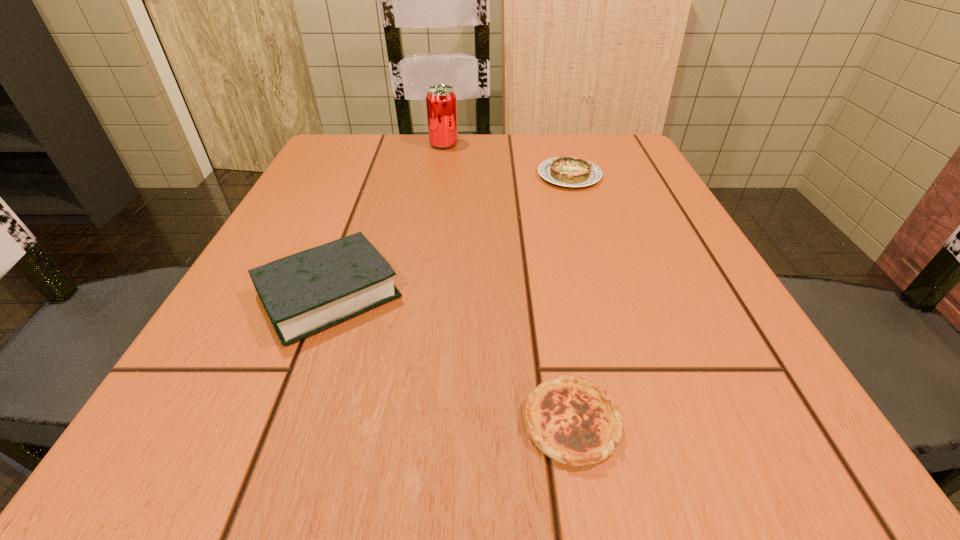
Identify the location of soda can that is at the far edge. click(x=441, y=101).

What are the coordinates of `quiche present at the far edge` in the screenshot? It's located at (567, 171).

Image resolution: width=960 pixels, height=540 pixels. Find the location of `object present at the near edge`. object present at the near edge is located at coordinates (574, 421).

At what (x,y) coordinates should I click in order to perform the action: click on object situated at the left edge. Please return your answer as a coordinate pair (x, y). Looking at the image, I should click on (304, 293).

Locate an element on the screen. Image resolution: width=960 pixels, height=540 pixels. object at the right edge is located at coordinates (567, 171).

Find the location of a particular element. This screenshot has width=960, height=540. object at the far right corner is located at coordinates (567, 171).

In the image, there is a desktop. Where is `vacant space at the far edge`? This screenshot has width=960, height=540. vacant space at the far edge is located at coordinates (522, 134).

Where is `free space at the near edge of the desktop`? The image size is (960, 540). free space at the near edge of the desktop is located at coordinates (451, 428).

This screenshot has height=540, width=960. I want to click on vacant space at the left edge of the desktop, so click(342, 197).

In the image, there is a desktop. Where is `vacant space at the right edge`? The width and height of the screenshot is (960, 540). vacant space at the right edge is located at coordinates (686, 241).